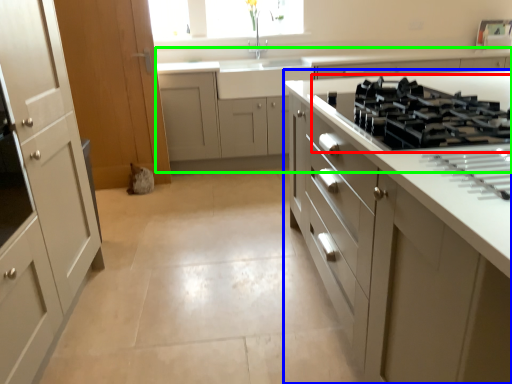
Question: Estimate the real-world distances between objects in this image. Which object is closer to gas stove (highlighted by a red box), cabinetry (highlighted by a blue box) or cabinetry (highlighted by a green box)?

Choices:
 (A) cabinetry
 (B) cabinetry

Answer: (A)